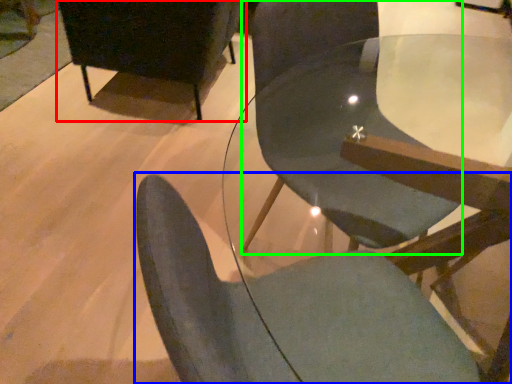
Question: Considering the real-world distances, which object is farthest from chair (highlighted by a red box)? chair (highlighted by a blue box) or chair (highlighted by a green box)?

Choices:
 (A) chair
 (B) chair

Answer: (A)